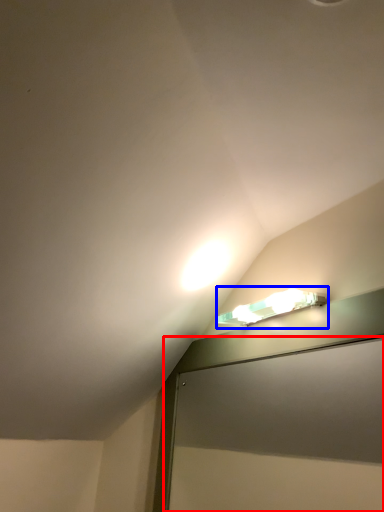
Question: Which point is closer to the camera, screen door (highlighted by a red box) or lamp (highlighted by a blue box)?

Choices:
 (A) screen door
 (B) lamp

Answer: (A)